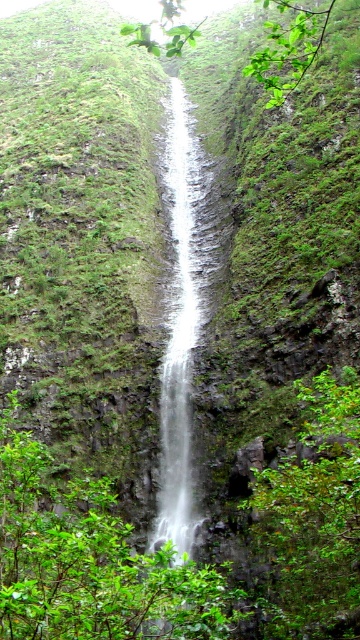
Question: Is green leafy bush at lower right below white smooth waterfall at center?

Choices:
 (A) yes
 (B) no

Answer: (A)

Question: From the image, what is the correct spatial relationship of green leafy shrubs at center in relation to green leafy bush at lower right?

Choices:
 (A) left
 (B) right

Answer: (A)

Question: Can you confirm if green leafy shrubs at center is smaller than white smooth waterfall at center?

Choices:
 (A) yes
 (B) no

Answer: (A)

Question: Estimate the real-world distances between objects in this image. Which object is farther from the white smooth waterfall at center?

Choices:
 (A) green leafy bush at lower right
 (B) green leafy shrubs at center

Answer: (B)

Question: Which of the following is the farthest from the observer?

Choices:
 (A) green leafy shrubs at center
 (B) green leafy bush at lower right
 (C) white smooth waterfall at center

Answer: (C)

Question: Which of the following is the closest to the observer?

Choices:
 (A) (69, 531)
 (B) (200, 227)

Answer: (A)